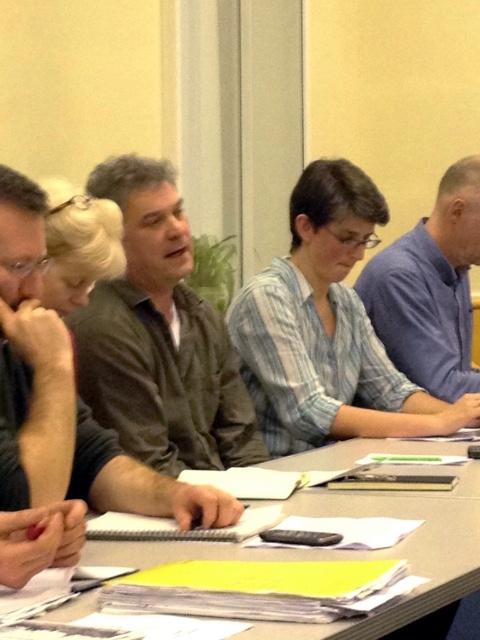
Does dark brown shirt at center have a greater width compared to smooth gray table at center?

In fact, dark brown shirt at center might be narrower than smooth gray table at center.

Does point (88, 376) come farther from viewer compared to point (465, 490)?

Yes, point (88, 376) is behind point (465, 490).

Is point (175, 461) farther from viewer compared to point (457, 568)?

Yes, it is.

In order to click on dark brown shirt at center in this screenshot , I will do `click(159, 339)`.

Is point (264, 456) more distant than point (444, 248)?

No, it is in front of (444, 248).

Identify the location of dark brown shirt at center. Image resolution: width=480 pixels, height=640 pixels. (159, 339).

Between smooth gray table at center and blue shirt at right, which one has more height?

blue shirt at right is taller.

Which is in front, point (433, 508) or point (451, 388)?

Point (433, 508) is in front.

Where is `smooth gray table at center`? The image size is (480, 640). smooth gray table at center is located at coordinates (354, 552).